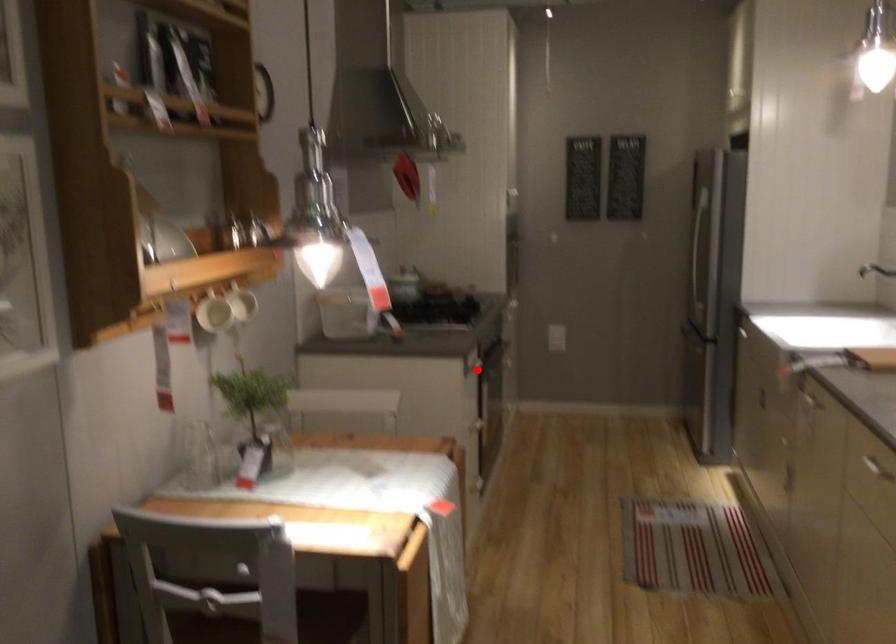
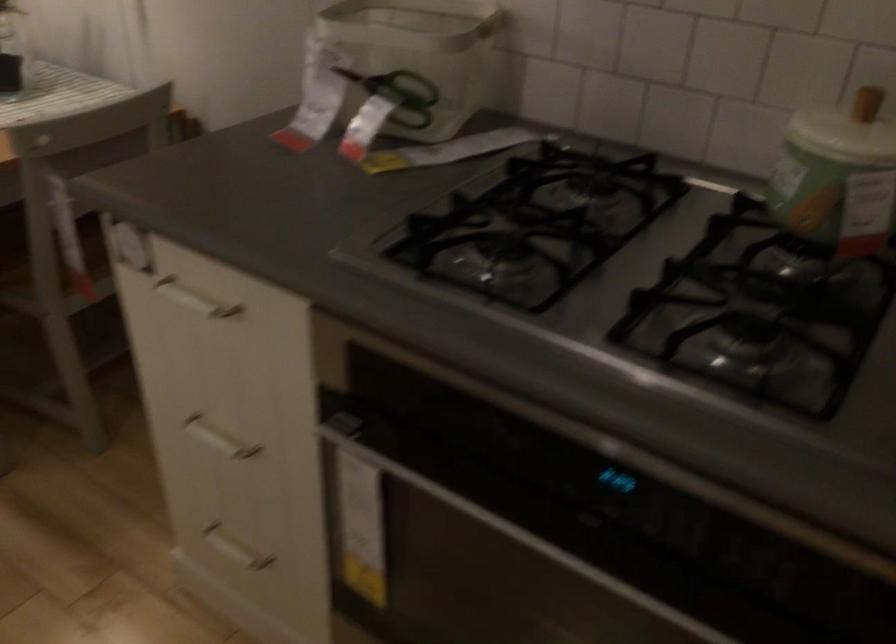
In the second image, find the point that corresponds to the highlighted location in the first image.

(194, 299)